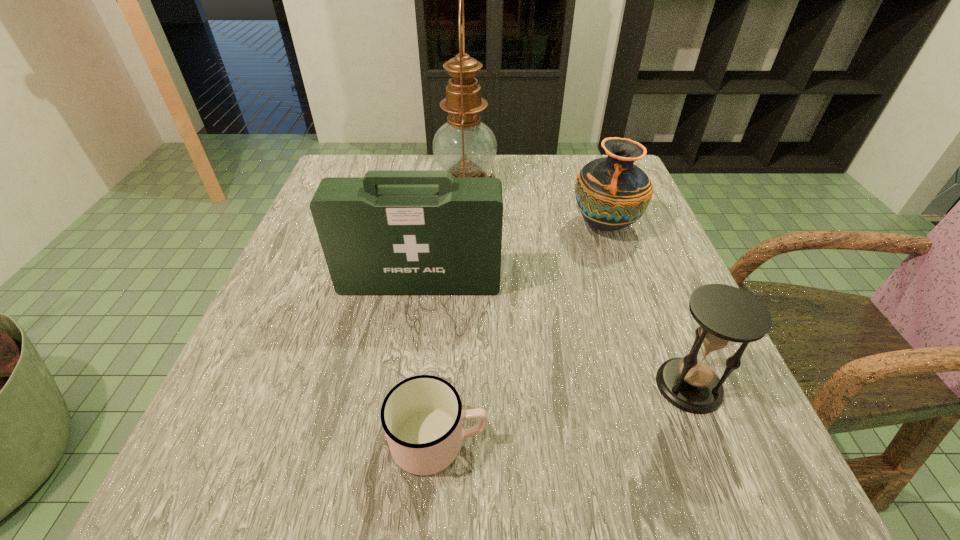
Identify the location of free region at the left edge of the desktop. The height and width of the screenshot is (540, 960). (275, 291).

Find the location of a particular element. free space at the right edge of the desktop is located at coordinates (640, 391).

Where is `vacant space at the far left corner of the desktop`? vacant space at the far left corner of the desktop is located at coordinates [368, 164].

In order to click on empty location between the first-aid kit and the pottery in this screenshot , I will do click(513, 254).

At what (x,y) coordinates should I click in order to perform the action: click on free space between the pottery and the shortest object. Please return your answer as a coordinate pair (x, y). Image resolution: width=960 pixels, height=540 pixels. Looking at the image, I should click on (521, 333).

Locate an element on the screen. The image size is (960, 540). free space between the hourglass and the shortest object is located at coordinates (564, 413).

Where is `free space between the fourth shortest object and the hourglass`? The height and width of the screenshot is (540, 960). free space between the fourth shortest object and the hourglass is located at coordinates (554, 334).

Locate an element on the screen. free space between the pottery and the hourglass is located at coordinates (647, 306).

Where is `free space between the hourglass and the fourth shortest object`? free space between the hourglass and the fourth shortest object is located at coordinates (554, 334).

The width and height of the screenshot is (960, 540). I want to click on unoccupied position between the shortest object and the oil lamp, so click(x=452, y=313).